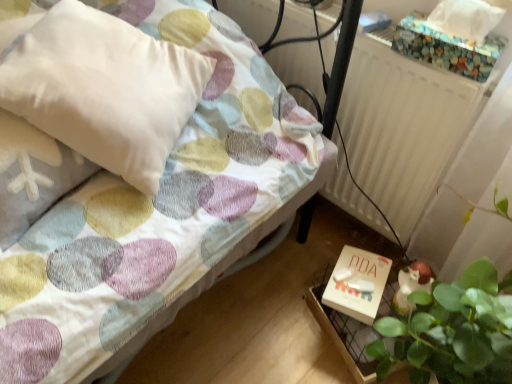
Question: From a real-world perspective, relative to pastel polka dot fabric bed at center, is white matte box at lower right vertically above or below?

Choices:
 (A) below
 (B) above

Answer: (A)

Question: From the image's perspective, is white matte box at lower right positioned above or below pastel polka dot fabric bed at center?

Choices:
 (A) above
 (B) below

Answer: (B)

Question: Which object is the farthest from the white matte radiator at upper right?

Choices:
 (A) pastel polka dot fabric bed at center
 (B) white matte box at lower right
 (C) white soft pillow at upper left

Answer: (C)

Question: Which is farther from the white matte radiator at upper right?

Choices:
 (A) white matte box at lower right
 (B) pastel polka dot fabric bed at center
 (C) white soft pillow at upper left

Answer: (C)